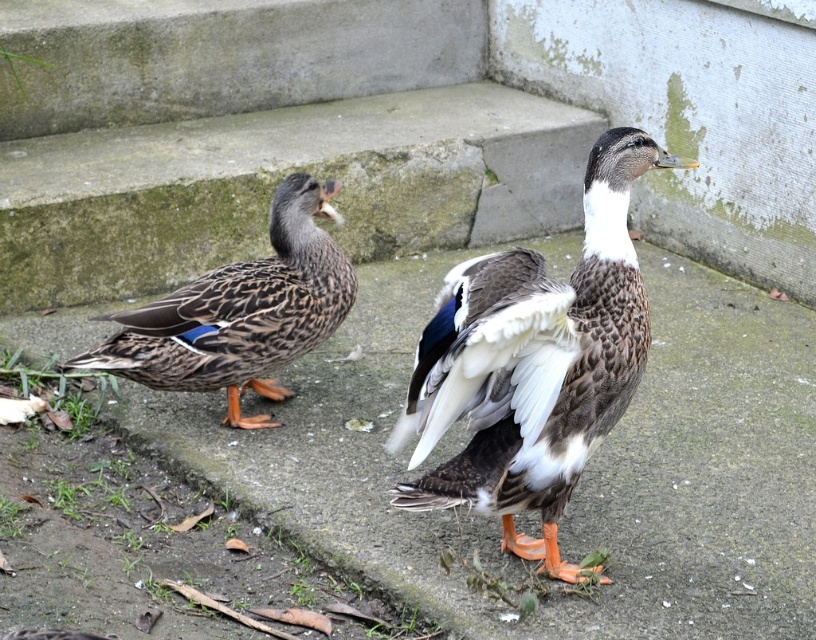
You are a photographer trying to capture both the gray concrete pavement at center and the brown speckled feathers at left in a single shot. Since you want to focus on the smaller object, which one should you adjust your camera to prioritize in terms of size?

The gray concrete pavement at center is larger in size than brown speckled feathers at left, so you should prioritize focusing on the brown speckled feathers at left as it is the smaller object.

You are a photographer trying to capture both the gray concrete pavement at center and the brown speckled duck at center in a single shot. Based on their heights, which object should you focus on first to ensure both are in frame?

The gray concrete pavement at center is not as tall as the brown speckled duck at center, so you should focus on the brown speckled duck at center first to ensure both are in frame.

You are standing at the origin point in the image and want to walk towards the gray concrete pavement at center. Which direction should you move in to reach it?

The gray concrete pavement at center is located at point (579, 477), so you should move in the positive x and y direction to reach it.